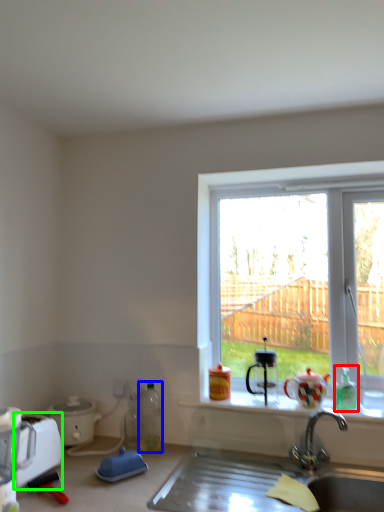
Question: Which is farther away from bottle (highlighted by a red box)? bottle (highlighted by a blue box) or appliance (highlighted by a green box)?

Choices:
 (A) bottle
 (B) appliance

Answer: (B)